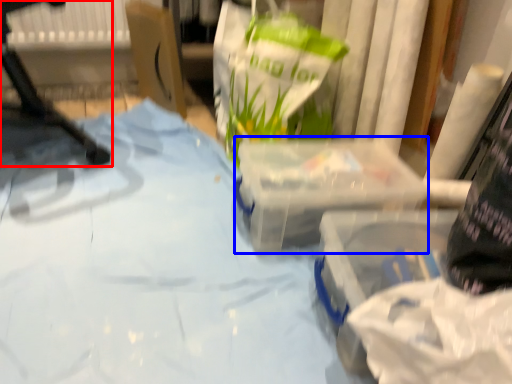
Question: Which object appears closest to the camera in this image, furniture (highlighted by a red box) or box (highlighted by a blue box)?

Choices:
 (A) furniture
 (B) box

Answer: (A)